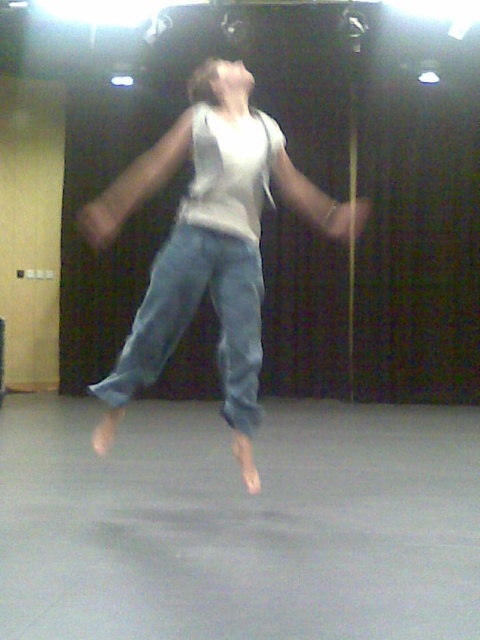
You are a fashion designer analyzing a dancer in motion. The dancer is wearing a white cotton tank top at center and denim at center. Which clothing item is narrower in width?

The white cotton tank top at center has a lesser width compared to denim at center, so the white cotton tank top at center is narrower.

You are a photographer setting up for a dance performance. You need to place two lights in the studio. The first light should be positioned to illuminate the white cotton tank top at center, and the second light to illuminate the denim at center. Given that the two areas are 5.22 meters apart, what is the minimum distance you should set between the two lights to ensure each light focuses on its target without overlapping?

The minimum distance between the two lights should be at least 5.22 meters to ensure each light focuses on its respective target without overlapping, as the white cotton tank top at center and denim at center are 5.22 meters apart.